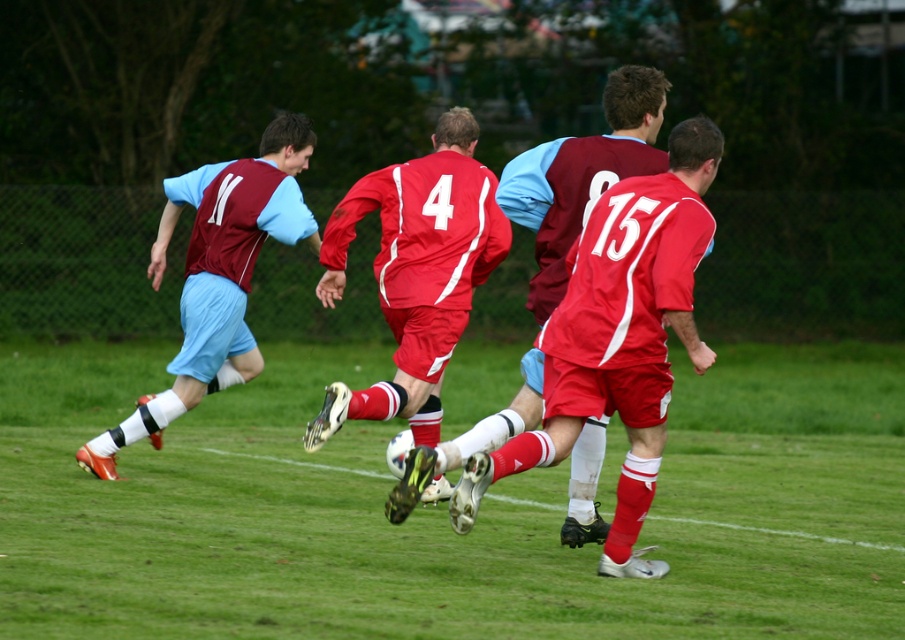
You are a soccer player trying to reach the ball first. You see the matte red jersey at center and the matte red soccer ball at center. Which one is nearer to you?

The matte red jersey at center is closer to the viewer than the matte red soccer ball at center, so the matte red jersey at center is nearer to you.

In the scene shown: You are a soccer referee observing the match. You notice the matte red jersey at center and the matte maroon jersey at left. Which player is positioned further to the right side of the field?

The matte red jersey at center is positioned further to the right side of the field compared to the matte maroon jersey at left.

You are a referee observing the soccer match. You notice the matte red jersey at center and the matte red soccer ball at center. Which object is taller?

The matte red jersey at center is taller than the matte red soccer ball at center.